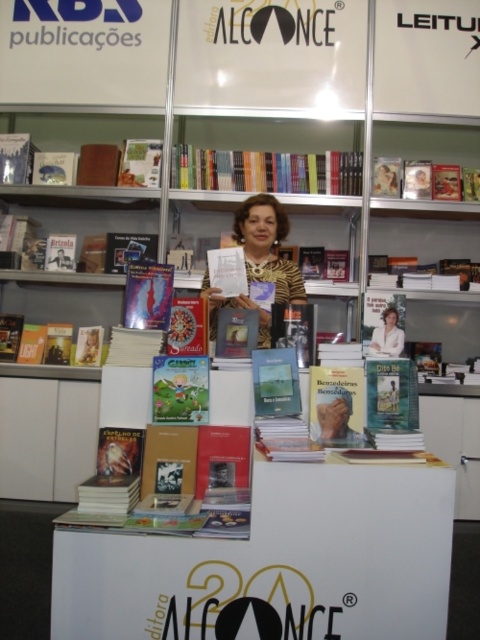
Question: Is matte yellow book at center bigger than hardcover book at center?

Choices:
 (A) no
 (B) yes

Answer: (A)

Question: Is hardcover book at center smaller than matte white blouse at center?

Choices:
 (A) yes
 (B) no

Answer: (B)

Question: Which object appears farthest from the camera in this image?

Choices:
 (A) hardcover book at center
 (B) hardcover book at lower left
 (C) matte white blouse at center

Answer: (B)

Question: Estimate the real-world distances between objects in this image. Which object is closer to the matte yellow book at center?

Choices:
 (A) matte green book at center
 (B) hardcover book at lower left

Answer: (A)

Question: Can you confirm if leopard print blouse at center is positioned to the right of hardcover book at lower left?

Choices:
 (A) yes
 (B) no

Answer: (A)

Question: Among these objects, which one is nearest to the camera?

Choices:
 (A) matte white blouse at center
 (B) leopard print blouse at center
 (C) hardcover book at lower left

Answer: (A)